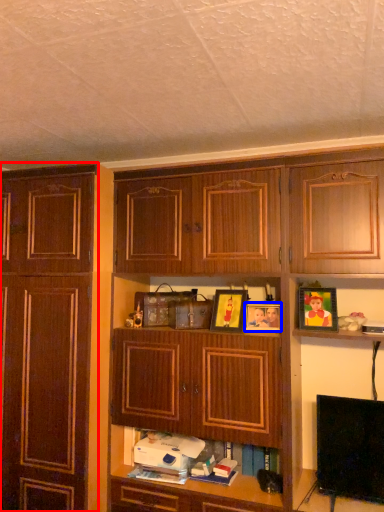
Question: Which object appears closest to the camera in this image, cabinetry (highlighted by a red box) or picture frame (highlighted by a blue box)?

Choices:
 (A) cabinetry
 (B) picture frame

Answer: (A)